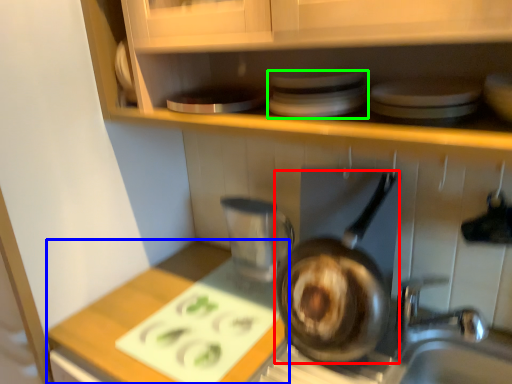
Question: Which object is positioned farthest from frying pan (highlighted by a red box)? Select from counter top (highlighted by a blue box) and appliance (highlighted by a green box).

Choices:
 (A) counter top
 (B) appliance

Answer: (B)